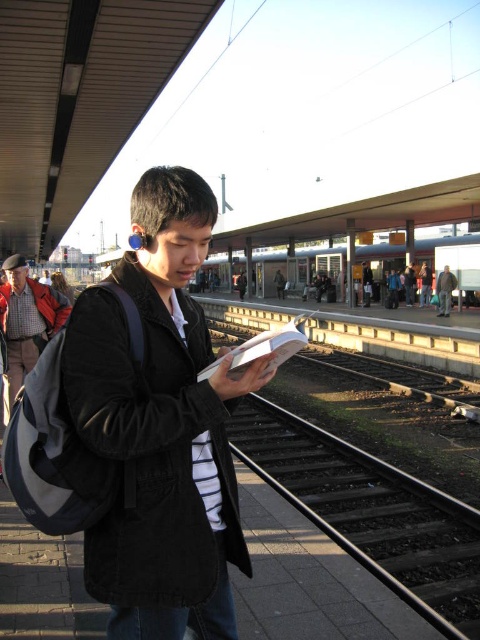
Question: Does black corduroy jacket at center appear under black metal train track at center?

Choices:
 (A) yes
 (B) no

Answer: (B)

Question: Based on their relative distances, which object is farther from the black metal train track at center?

Choices:
 (A) checkered wool sweater at left
 (B) dark gray jacket at center
 (C) black corduroy jacket at center

Answer: (B)

Question: Observing the image, what is the correct spatial positioning of black metal train track at center in reference to silver metallic train at center?

Choices:
 (A) below
 (B) above

Answer: (A)

Question: Is checkered wool sweater at left above dark gray jacket at center?

Choices:
 (A) yes
 (B) no

Answer: (B)

Question: Which of these objects is positioned closest to the dark gray jacket at center?

Choices:
 (A) checkered wool sweater at left
 (B) black corduroy jacket at center
 (C) black metal train track at center

Answer: (C)

Question: Among these points, which one is farthest from the camera?

Choices:
 (A) (97, 444)
 (B) (453, 276)

Answer: (B)